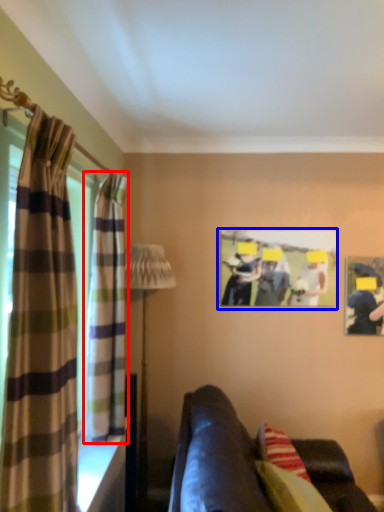
Question: Which point is closer to the camera, curtain (highlighted by a red box) or picture frame (highlighted by a blue box)?

Choices:
 (A) curtain
 (B) picture frame

Answer: (A)